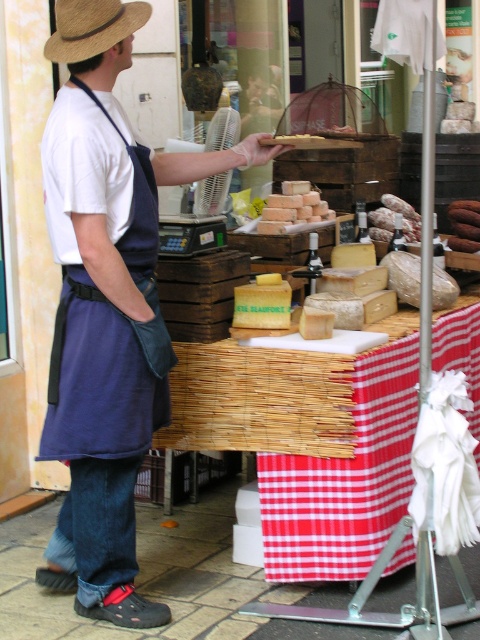
You are a customer at the market stall and want to know if the red checkered tablecloth at center can be seen from above the straw hat at upper left. Based on their positions, can you see the tablecloth from above the hat?

The red checkered tablecloth at center is taller than the straw hat at upper left, so yes, you can see the tablecloth from above the hat since it extends higher.

You are standing at the entrance of the market stall and notice the straw hat at upper left. Can you determine its exact position using the coordinate system provided?

The straw hat at upper left is located at point (92,28) according to the coordinate system provided.

You are standing at the market stall and want to reach the point labeled as point (76,16). However, there is an obstacle at point (360,570). Can you walk directly to your destination without going around the obstacle?

Since point (360,570) is behind point (76,16), you can walk directly to point (76,16) without needing to go around the obstacle at point (360,570).